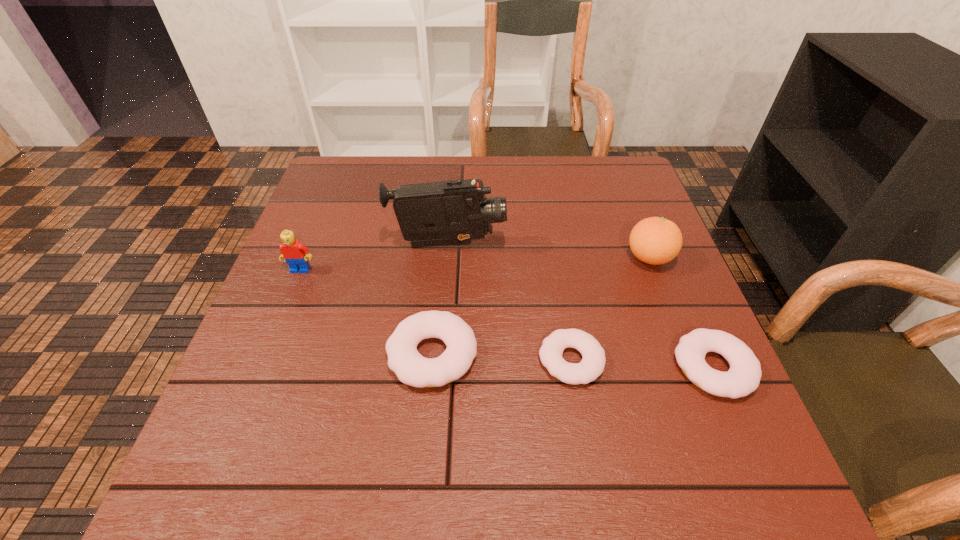
This screenshot has width=960, height=540. Identify the location of free space between the orange and the leftmost object. pyautogui.click(x=475, y=264).

What are the coordinates of `empty space between the fifth tallest object and the Lego` in the screenshot? It's located at (507, 319).

Identify the location of free space between the leftmost object and the camcorder. The image size is (960, 540). (374, 257).

Locate an element on the screen. free space between the Lego and the rightmost doughnut is located at coordinates (507, 319).

You are a GUI agent. You are given a task and a screenshot of the screen. Output one action in this format:
    pyautogui.click(x=<x>, y=<y>)
    Task: Click on the vacant area that lies between the leftmost object and the fifth tallest object
    
    Given the screenshot: What is the action you would take?
    pyautogui.click(x=507, y=319)

Locate which object is the second closest to the leftmost doughnut. Please provide its 2D coordinates. Your answer should be formatted as a tuple, i.e. [(x, y)], where the tuple contains the x and y coordinates of a point satisfying the conditions above.

[(455, 212)]

Locate an element on the screen. This screenshot has height=540, width=960. object that is the second closest to the camcorder is located at coordinates (411, 368).

Select which doughnut is the closest to the camcorder. Please provide its 2D coordinates. Your answer should be formatted as a tuple, i.e. [(x, y)], where the tuple contains the x and y coordinates of a point satisfying the conditions above.

[(411, 368)]

You are a GUI agent. You are given a task and a screenshot of the screen. Output one action in this format:
    pyautogui.click(x=<x>, y=<y>)
    Task: Click on the doughnut that is the second nearest to the shortest doughnut
    
    Given the screenshot: What is the action you would take?
    pyautogui.click(x=743, y=377)

The height and width of the screenshot is (540, 960). I want to click on free space in the image that satisfies the following two spatial constraints: 1. on the face of the Lego; 2. on the left side of the fifth tallest object, so click(x=261, y=368).